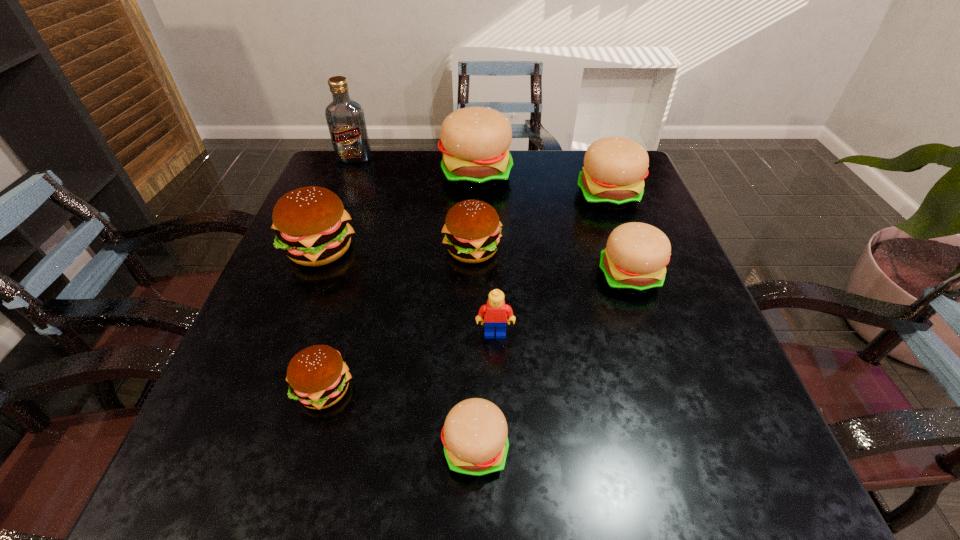
I want to click on vodka that is positioned at the far edge, so click(x=345, y=118).

Identify the location of object at the near edge. The image size is (960, 540). (474, 435).

Image resolution: width=960 pixels, height=540 pixels. I want to click on vodka at the left edge, so click(x=345, y=118).

Locate an element on the screen. Image resolution: width=960 pixels, height=540 pixels. object located at the far left corner is located at coordinates (345, 118).

You are a GUI agent. You are given a task and a screenshot of the screen. Output one action in this format:
    pyautogui.click(x=<x>, y=<y>)
    Task: Click on the object at the far right corner
    The width and height of the screenshot is (960, 540).
    Given the screenshot: What is the action you would take?
    (x=614, y=170)

At what (x,y) coordinates should I click in order to perform the action: click on free location at the far edge. Please return your answer as a coordinate pair (x, y). This screenshot has width=960, height=540. Looking at the image, I should click on (556, 187).

The width and height of the screenshot is (960, 540). Identify the location of free region at the near edge. pos(625,478).

In order to click on free space at the left edge of the desktop in this screenshot , I will do `click(361, 202)`.

Find the location of a particular element. free region at the right edge of the desktop is located at coordinates (700, 329).

You are a GUI agent. You are given a task and a screenshot of the screen. Output one action in this format:
    pyautogui.click(x=<x>, y=<y>)
    Task: Click on the vacant space at the near left corner of the desktop
    Image resolution: width=960 pixels, height=540 pixels.
    Given the screenshot: What is the action you would take?
    pyautogui.click(x=188, y=451)